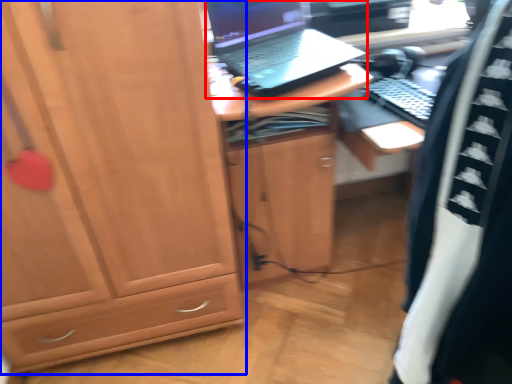
Question: Which of the following is the closest to the observer, laptop (highlighted by a red box) or cabinetry (highlighted by a blue box)?

Choices:
 (A) laptop
 (B) cabinetry

Answer: (B)